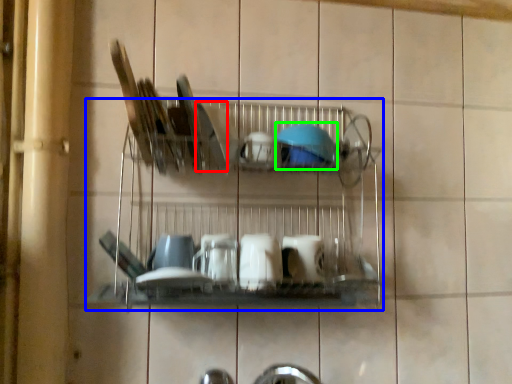
Question: Which object is positioned farthest from tableware (highlighted by a red box)? Select from shelf (highlighted by a blue box) and tableware (highlighted by a green box).

Choices:
 (A) shelf
 (B) tableware

Answer: (A)